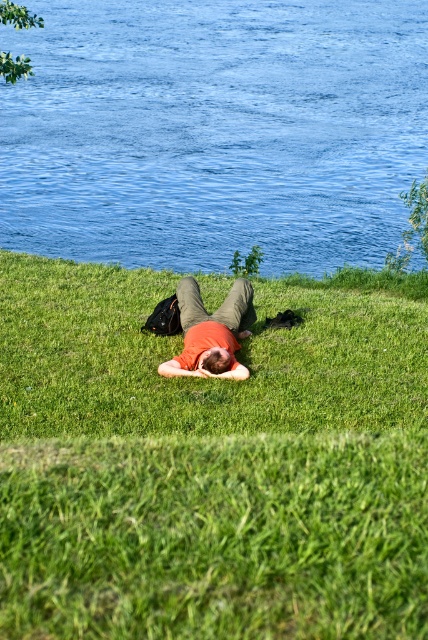
You are a photographer planning to take a portrait of the person in the scene. You want to ensure the blue liquid water at upper center is visible in the background while keeping the green grassy at center as the main focus. Which object should be closer to the camera to achieve this composition?

To have the green grassy at center as the main focus with the blue liquid water at upper center in the background, the green grassy at center should be closer to the camera. This positioning ensures the grass is prominent while the water remains visible behind it.

You are standing at the point marked by the coordinates point (208, 467) in the image. What is the immediate surface you are standing on?

The point (208, 467) indicates green grassy at center, so you are standing on green grassy at center.